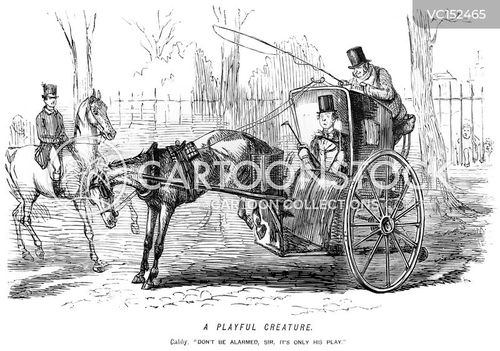
Where is `blinders`? blinders is located at coordinates (106, 192).